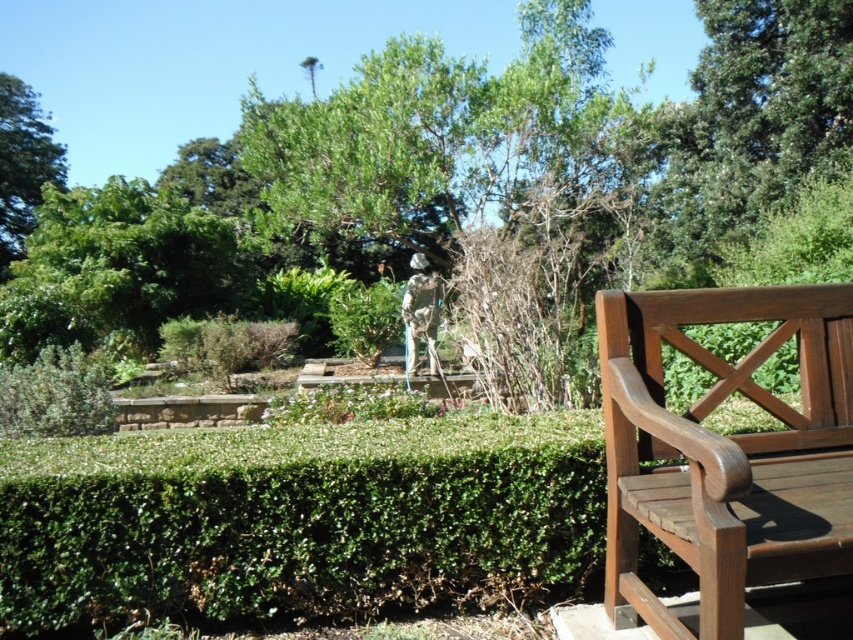
How far apart are green leafy tree at center and silver metallic statue at center?

The distance of green leafy tree at center from silver metallic statue at center is 5.76 meters.

Who is positioned more to the left, green leafy tree at center or silver metallic statue at center?

From the viewer's perspective, green leafy tree at center appears more on the left side.

Does point (117, 248) come farther from viewer compared to point (409, 324)?

Yes.

Identify the location of green leafy tree at center. (457, 182).

Is point (746, 128) less distant than point (6, 202)?

Yes, point (746, 128) is closer to viewer.

Is green leafy tree at center shorter than green leafy tree at upper left?

No.

Is point (242, 122) closer to camera compared to point (10, 211)?

Yes.

You are a GUI agent. You are given a task and a screenshot of the screen. Output one action in this format:
    pyautogui.click(x=<x>, y=<y>)
    Task: Click on the green leafy tree at center
    
    Given the screenshot: What is the action you would take?
    pyautogui.click(x=457, y=182)

Which is behind, point (689, 516) or point (3, 93)?

Positioned behind is point (3, 93).

Can you confirm if dark brown wood bench at right is positioned above green leafy tree at upper left?

Actually, dark brown wood bench at right is below green leafy tree at upper left.

Find the location of a particular element. dark brown wood bench at right is located at coordinates (726, 451).